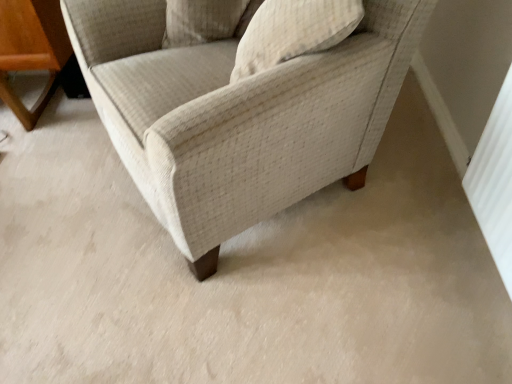
Question: Which direction should I rotate to look at textured beige pillow at upper center, which appears as the 2th pillow when viewed from the left, — up or down?

Choices:
 (A) down
 (B) up

Answer: (B)

Question: Does beige fabric chair at center have a lesser height compared to beige textured pillow at upper center, acting as the second pillow starting from the right?

Choices:
 (A) no
 (B) yes

Answer: (A)

Question: From a real-world perspective, is beige fabric chair at center beneath beige textured pillow at upper center, the first pillow viewed from the left?

Choices:
 (A) no
 (B) yes

Answer: (B)

Question: Considering the relative sizes of beige fabric chair at center and beige textured pillow at upper center, acting as the second pillow starting from the right, in the image provided, is beige fabric chair at center thinner than beige textured pillow at upper center, acting as the second pillow starting from the right,?

Choices:
 (A) yes
 (B) no

Answer: (B)

Question: Can you confirm if beige fabric chair at center is positioned to the left of beige textured pillow at upper center, the first pillow viewed from the left?

Choices:
 (A) no
 (B) yes

Answer: (A)

Question: Would you say beige fabric chair at center is outside beige textured pillow at upper center, acting as the second pillow starting from the right?

Choices:
 (A) yes
 (B) no

Answer: (A)

Question: From the image's perspective, is beige fabric chair at center under beige textured pillow at upper center, acting as the second pillow starting from the right?

Choices:
 (A) no
 (B) yes

Answer: (B)

Question: Is textured beige pillow at upper center, which appears as the 2th pillow when viewed from the left, placed right next to beige fabric chair at center?

Choices:
 (A) yes
 (B) no

Answer: (B)

Question: Is textured beige pillow at upper center, which appears as the 2th pillow when viewed from the left, positioned far away from beige fabric chair at center?

Choices:
 (A) yes
 (B) no

Answer: (B)

Question: Is textured beige pillow at upper center, the 1th pillow positioned from the right, at the left side of beige fabric chair at center?

Choices:
 (A) no
 (B) yes

Answer: (A)

Question: From a real-world perspective, does textured beige pillow at upper center, the 1th pillow positioned from the right, sit lower than beige fabric chair at center?

Choices:
 (A) yes
 (B) no

Answer: (B)

Question: Considering the relative positions of textured beige pillow at upper center, the 1th pillow positioned from the right, and beige fabric chair at center in the image provided, is textured beige pillow at upper center, the 1th pillow positioned from the right, in front of beige fabric chair at center?

Choices:
 (A) yes
 (B) no

Answer: (B)

Question: Does textured beige pillow at upper center, which appears as the 2th pillow when viewed from the left, have a lesser width compared to beige fabric chair at center?

Choices:
 (A) no
 (B) yes

Answer: (B)

Question: From a real-world perspective, does beige fabric chair at center stand above textured beige pillow at upper center, which appears as the 2th pillow when viewed from the left?

Choices:
 (A) no
 (B) yes

Answer: (A)